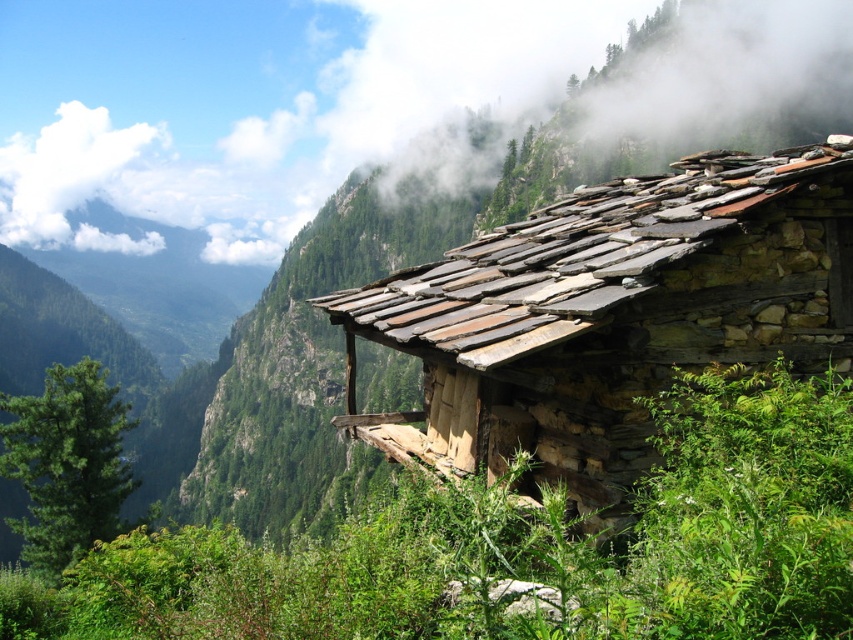
Which is behind, point (357, 308) or point (109, 509)?

The point (109, 509) is behind.

Identify the location of rustic stone cabin at upper right. 613,312.

What do you see at coordinates (521, 547) in the screenshot? I see `green leafy plant at lower center` at bounding box center [521, 547].

Does point (769, 500) come behind point (54, 387)?

That is False.

Between point (149, 604) and point (86, 444), which one is positioned in front?

Point (149, 604) is more forward.

At what (x,y) coordinates should I click in order to perform the action: click on green leafy plant at lower center. Please return your answer as a coordinate pair (x, y). The image size is (853, 640). Looking at the image, I should click on (521, 547).

Can you confirm if green leafy plant at lower center is positioned below rustic stone cabin at upper right?

Correct, green leafy plant at lower center is located below rustic stone cabin at upper right.

Which is above, green leafy plant at lower center or rustic stone cabin at upper right?

rustic stone cabin at upper right is above.

Measure the distance between green leafy plant at lower center and camera.

The distance of green leafy plant at lower center from camera is 5.55 meters.

This screenshot has width=853, height=640. I want to click on green leafy plant at lower center, so click(521, 547).